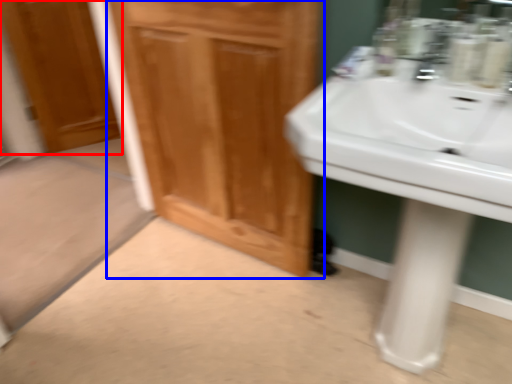
Question: Which object appears closest to the camera in this image, door (highlighted by a red box) or bathroom cabinet (highlighted by a blue box)?

Choices:
 (A) door
 (B) bathroom cabinet

Answer: (B)